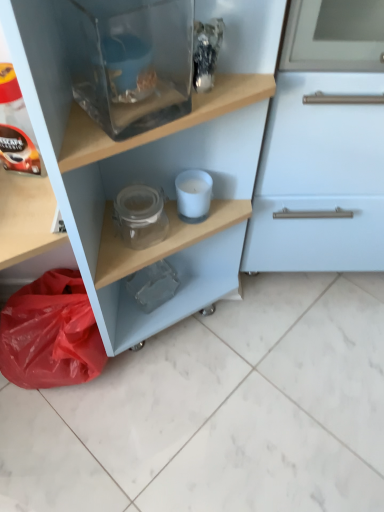
What are the coordinates of `transparent glass fish tank at upper center, the 2th appliance from the back` in the screenshot? It's located at (136, 64).

What do you see at coordinates (136, 64) in the screenshot? This screenshot has height=512, width=384. I see `transparent glass fish tank at upper center, arranged as the 1th appliance when viewed from the top` at bounding box center [136, 64].

Measure the distance between white matte candle at center, the first appliance positioned from the bottom, and camera.

white matte candle at center, the first appliance positioned from the bottom, and camera are 89.63 centimeters apart.

The height and width of the screenshot is (512, 384). I want to click on transparent glass jar at upper center, so click(x=222, y=161).

Measure the distance between white matte candle at center, acting as the second appliance starting from the top, and matte black coffee pod at left.

white matte candle at center, acting as the second appliance starting from the top, and matte black coffee pod at left are 12.83 inches apart from each other.

Is white matte candle at center, which appears as the 1th appliance when viewed from the back, completely or partially outside of matte black coffee pod at left?

white matte candle at center, which appears as the 1th appliance when viewed from the back, is positioned outside matte black coffee pod at left.

Between white matte candle at center, acting as the second appliance starting from the top, and matte black coffee pod at left, which one is positioned in front?

Positioned in front is matte black coffee pod at left.

Can you confirm if white matte candle at center, acting as the second appliance starting from the top, is shorter than matte black coffee pod at left?

Yes, white matte candle at center, acting as the second appliance starting from the top, is shorter than matte black coffee pod at left.

From a real-world perspective, is matte black coffee pod at left above or below red plastic bag at lower left?

In terms of real-world spatial position, matte black coffee pod at left is above red plastic bag at lower left.

Between matte black coffee pod at left and red plastic bag at lower left, which one has smaller size?

matte black coffee pod at left.

Is matte black coffee pod at left taller than red plastic bag at lower left?

No, matte black coffee pod at left is not taller than red plastic bag at lower left.

Which point is more distant from viewer, (124,21) or (184,198)?

The point (184,198) is farther from the camera.

Could you tell me if transparent glass fish tank at upper center, the 2th appliance from the back, is turned towards white matte candle at center, which appears as the 1th appliance when viewed from the back?

No, transparent glass fish tank at upper center, the 2th appliance from the back, is not oriented towards white matte candle at center, which appears as the 1th appliance when viewed from the back.

From the image's perspective, is transparent glass fish tank at upper center, arranged as the 1th appliance when viewed from the front, above or below white matte candle at center, acting as the second appliance starting from the top?

Based on their image positions, transparent glass fish tank at upper center, arranged as the 1th appliance when viewed from the front, is located above white matte candle at center, acting as the second appliance starting from the top.

Between transparent glass fish tank at upper center, the 2th appliance from the back, and white matte candle at center, acting as the second appliance starting from the top, which one has smaller size?

white matte candle at center, acting as the second appliance starting from the top, is smaller.

Can you tell me how much matte black coffee pod at left and white matte candle at center, acting as the second appliance starting from the top, differ in facing direction?

The facing directions of matte black coffee pod at left and white matte candle at center, acting as the second appliance starting from the top, are 15.7 degrees apart.

Locate an element on the screen. Image resolution: width=384 pixels, height=512 pixels. appliance that is under the matte black coffee pod at left (from a real-world perspective) is located at coordinates (193, 194).

From a real-world perspective, which is physically below, matte black coffee pod at left or white matte candle at center, arranged as the 2th appliance when viewed from the front?

In real-world perspective, white matte candle at center, arranged as the 2th appliance when viewed from the front, is lower.

Does matte black coffee pod at left have a greater width compared to white matte candle at center, acting as the second appliance starting from the top?

Yes.

Between red plastic bag at lower left and transparent glass jar at upper center, which one has smaller size?

red plastic bag at lower left is smaller.

You are a GUI agent. You are given a task and a screenshot of the screen. Output one action in this format:
    pyautogui.click(x=<x>, y=<y>)
    Task: Click on the cupboard above the red plastic bag at lower left (from a real-world perspective)
    The width and height of the screenshot is (384, 512).
    Given the screenshot: What is the action you would take?
    pyautogui.click(x=222, y=161)

Does red plastic bag at lower left have a greater width compared to transparent glass jar at upper center?

No.

Would you say red plastic bag at lower left is to the left or to the right of white matte candle at center, which appears as the 1th appliance when viewed from the back, in the picture?

Clearly, red plastic bag at lower left is on the left of white matte candle at center, which appears as the 1th appliance when viewed from the back, in the image.

Which appliance is the 1st one when counting from the front of the red plastic bag at lower left? Please provide its 2D coordinates.

[(193, 194)]

From the picture: Do you think red plastic bag at lower left is within white matte candle at center, which appears as the 1th appliance when viewed from the back, or outside of it?

red plastic bag at lower left is not enclosed by white matte candle at center, which appears as the 1th appliance when viewed from the back.

From a real-world perspective, is transparent glass jar at upper center positioned under white matte candle at center, acting as the second appliance starting from the top, based on gravity?

Incorrect, from a real-world perspective, transparent glass jar at upper center is higher than white matte candle at center, acting as the second appliance starting from the top.

Would you say transparent glass jar at upper center is a long distance from white matte candle at center, which appears as the 1th appliance when viewed from the back?

No, transparent glass jar at upper center is not far from white matte candle at center, which appears as the 1th appliance when viewed from the back.

The height and width of the screenshot is (512, 384). There is a transparent glass jar at upper center. In order to click on the 1st appliance above it (from the image's perspective) in this screenshot , I will do `click(193, 194)`.

From the image's perspective, does transparent glass jar at upper center appear higher than white matte candle at center, which appears as the 1th appliance when viewed from the back?

No, from the image's perspective, transparent glass jar at upper center is not above white matte candle at center, which appears as the 1th appliance when viewed from the back.

Image resolution: width=384 pixels, height=512 pixels. Identify the location of appliance behind the matte black coffee pod at left. (193, 194).

Find the location of a particular element. This screenshot has height=512, width=384. material that is under the matte black coffee pod at left (from a real-world perspective) is located at coordinates (50, 333).

When comparing their distances from transparent glass fish tank at upper center, arranged as the 1th appliance when viewed from the top, does red plastic bag at lower left or matte black coffee pod at left seem further?

Among the two, red plastic bag at lower left is located further to transparent glass fish tank at upper center, arranged as the 1th appliance when viewed from the top.

Based on their spatial positions, is transparent glass jar at upper center or matte black coffee pod at left closer to transparent glass fish tank at upper center, arranged as the 1th appliance when viewed from the top?

Based on the image, matte black coffee pod at left appears to be nearer to transparent glass fish tank at upper center, arranged as the 1th appliance when viewed from the top.

Estimate the real-world distances between objects in this image. Which object is further from red plastic bag at lower left, transparent glass fish tank at upper center, which is the 2th appliance in bottom-to-top order, or matte black coffee pod at left?

transparent glass fish tank at upper center, which is the 2th appliance in bottom-to-top order, lies further to red plastic bag at lower left than the other object.

Looking at the image, which one is located closer to matte black coffee pod at left, red plastic bag at lower left or white matte candle at center, acting as the second appliance starting from the top?

white matte candle at center, acting as the second appliance starting from the top, is positioned closer to the anchor matte black coffee pod at left.

Considering their positions, is transparent glass jar at upper center positioned further to red plastic bag at lower left than transparent glass fish tank at upper center, arranged as the 1th appliance when viewed from the front?

transparent glass fish tank at upper center, arranged as the 1th appliance when viewed from the front, is positioned further to the anchor red plastic bag at lower left.

When comparing their distances from transparent glass fish tank at upper center, arranged as the 1th appliance when viewed from the top, does transparent glass jar at upper center or red plastic bag at lower left seem closer?

Based on the image, transparent glass jar at upper center appears to be nearer to transparent glass fish tank at upper center, arranged as the 1th appliance when viewed from the top.

When comparing their distances from red plastic bag at lower left, does transparent glass jar at upper center or matte black coffee pod at left seem further?

Among the two, matte black coffee pod at left is located further to red plastic bag at lower left.

Looking at the image, which one is located further to white matte candle at center, the first appliance positioned from the bottom, red plastic bag at lower left or transparent glass fish tank at upper center, arranged as the 1th appliance when viewed from the top?

red plastic bag at lower left lies further to white matte candle at center, the first appliance positioned from the bottom, than the other object.

Where is `bottle that lies between transparent glass fish tank at upper center, which is the 2th appliance in bottom-to-top order, and red plastic bag at lower left from top to bottom`? This screenshot has width=384, height=512. bottle that lies between transparent glass fish tank at upper center, which is the 2th appliance in bottom-to-top order, and red plastic bag at lower left from top to bottom is located at coordinates (16, 128).

At what (x,y) coordinates should I click in order to perform the action: click on appliance between transparent glass fish tank at upper center, the 2th appliance from the back, and red plastic bag at lower left from front to back. Please return your answer as a coordinate pair (x, y). This screenshot has height=512, width=384. Looking at the image, I should click on (193, 194).

In order to click on bottle between transparent glass fish tank at upper center, the 2th appliance from the back, and white matte candle at center, the first appliance positioned from the bottom, along the z-axis in this screenshot , I will do `click(16, 128)`.

At what (x,y) coordinates should I click in order to perform the action: click on bottle between transparent glass jar at upper center and white matte candle at center, which appears as the 1th appliance when viewed from the back, from front to back. Please return your answer as a coordinate pair (x, y). Looking at the image, I should click on (16, 128).